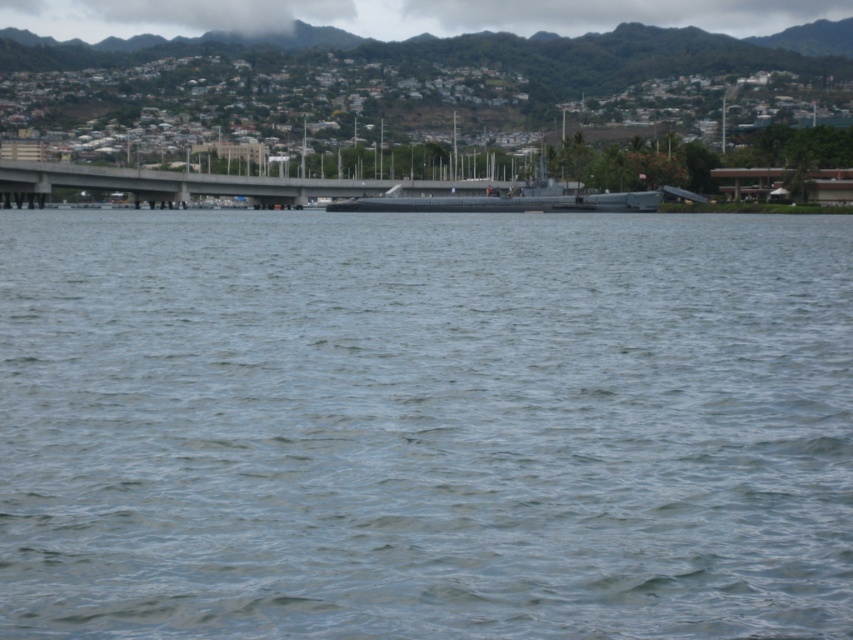
Can you confirm if gray water at center is wider than concrete bridge at center?

No, gray water at center is not wider than concrete bridge at center.

Does gray water at center appear on the right side of concrete bridge at center?

Correct, you'll find gray water at center to the right of concrete bridge at center.

Does point (309, 572) come farther from viewer compared to point (216, 186)?

No, it is in front of (216, 186).

Locate an element on the screen. The height and width of the screenshot is (640, 853). gray water at center is located at coordinates (424, 424).